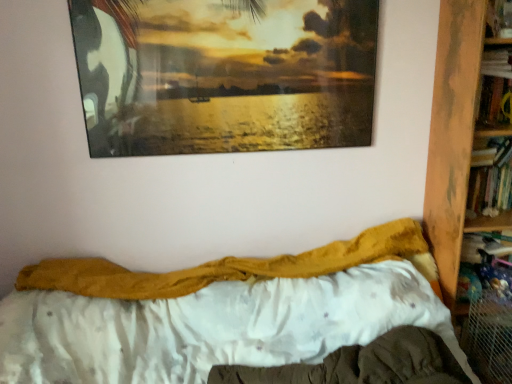
Question: Is fuzzy yellow blanket at center far away from wooden bookcase at right?

Choices:
 (A) no
 (B) yes

Answer: (A)

Question: From a real-world perspective, is fuzzy yellow blanket at center below wooden bookcase at right?

Choices:
 (A) no
 (B) yes

Answer: (B)

Question: Is fuzzy yellow blanket at center taller than wooden bookcase at right?

Choices:
 (A) no
 (B) yes

Answer: (A)

Question: Is fuzzy yellow blanket at center further to the viewer compared to wooden bookcase at right?

Choices:
 (A) yes
 (B) no

Answer: (B)

Question: From a real-world perspective, does fuzzy yellow blanket at center stand above wooden bookcase at right?

Choices:
 (A) yes
 (B) no

Answer: (B)

Question: Does fuzzy yellow blanket at center have a lesser height compared to wooden bookcase at right?

Choices:
 (A) yes
 (B) no

Answer: (A)

Question: Is mustard yellow fabric at center aimed at wooden bookcase at right?

Choices:
 (A) no
 (B) yes

Answer: (A)

Question: Is mustard yellow fabric at center oriented away from wooden bookcase at right?

Choices:
 (A) yes
 (B) no

Answer: (B)

Question: Does mustard yellow fabric at center have a lesser height compared to wooden bookcase at right?

Choices:
 (A) no
 (B) yes

Answer: (B)

Question: Can you confirm if mustard yellow fabric at center is taller than wooden bookcase at right?

Choices:
 (A) yes
 (B) no

Answer: (B)

Question: Considering the relative positions of mustard yellow fabric at center and wooden bookcase at right in the image provided, is mustard yellow fabric at center behind wooden bookcase at right?

Choices:
 (A) yes
 (B) no

Answer: (A)

Question: Considering the relative sizes of mustard yellow fabric at center and wooden bookcase at right in the image provided, is mustard yellow fabric at center thinner than wooden bookcase at right?

Choices:
 (A) yes
 (B) no

Answer: (A)

Question: Is wooden bookcase at right at the left side of mustard yellow fabric at center?

Choices:
 (A) no
 (B) yes

Answer: (A)